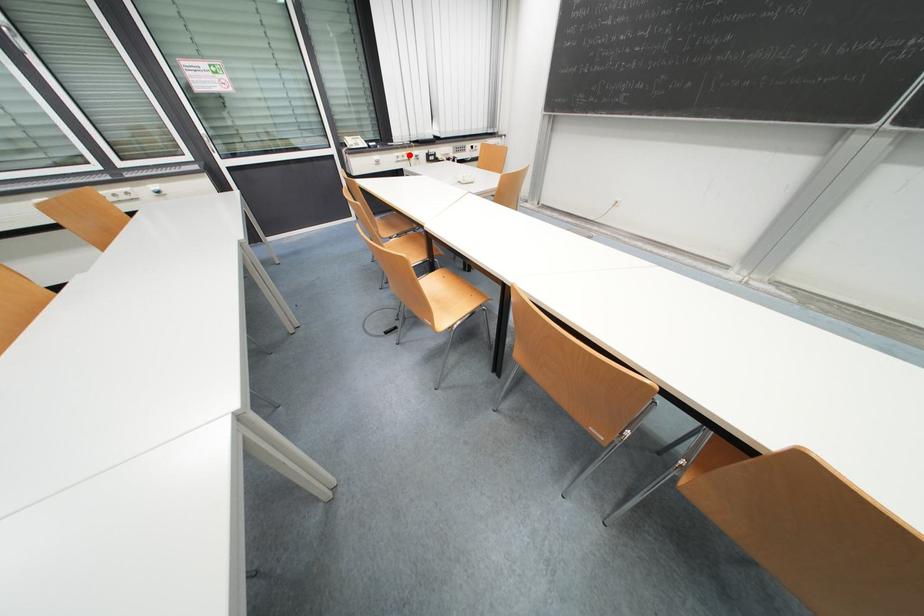
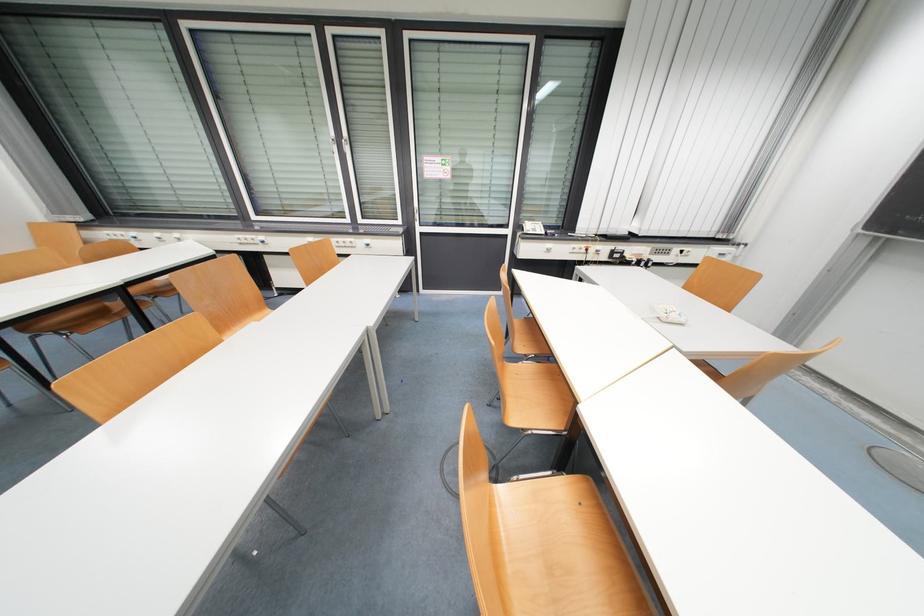
Question: A red point is marked in image1. In image2, is the corresponding 3D point closer to the camera or farther? Reply with the corresponding letter.

Choices:
 (A) The corresponding 3D point is closer.
 (B) The corresponding 3D point is farther.

Answer: (A)